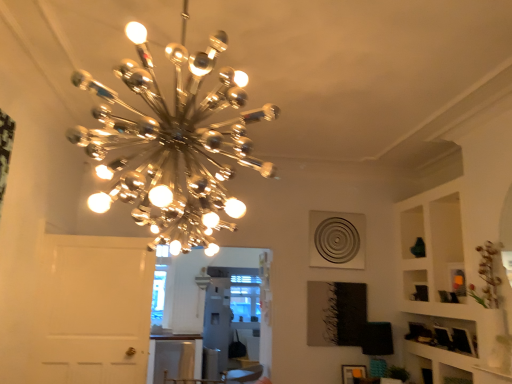
Question: Is matte orange picture frame at lower right a part of white glossy table at lower center?

Choices:
 (A) no
 (B) yes

Answer: (A)

Question: Is white glossy table at lower center smaller than matte orange picture frame at lower right?

Choices:
 (A) yes
 (B) no

Answer: (B)

Question: From the image's perspective, is white glossy table at lower center on top of matte orange picture frame at lower right?

Choices:
 (A) no
 (B) yes

Answer: (A)

Question: Can you confirm if white glossy table at lower center is bigger than matte orange picture frame at lower right?

Choices:
 (A) no
 (B) yes

Answer: (B)

Question: From the image's perspective, is white glossy table at lower center under matte orange picture frame at lower right?

Choices:
 (A) no
 (B) yes

Answer: (B)

Question: From the image's perspective, relative to matte orange picture frame at lower right, is chrome/metallic chandelier at upper center above or below?

Choices:
 (A) above
 (B) below

Answer: (A)

Question: Is chrome/metallic chandelier at upper center inside or outside of matte orange picture frame at lower right?

Choices:
 (A) inside
 (B) outside

Answer: (B)

Question: Considering the relative positions of chrome/metallic chandelier at upper center and matte orange picture frame at lower right in the image provided, is chrome/metallic chandelier at upper center to the left or to the right of matte orange picture frame at lower right?

Choices:
 (A) right
 (B) left

Answer: (B)

Question: From a real-world perspective, relative to matte orange picture frame at lower right, is chrome/metallic chandelier at upper center vertically above or below?

Choices:
 (A) below
 (B) above

Answer: (B)

Question: Considering the positions of point (187, 339) and point (349, 380), is point (187, 339) closer or farther from the camera than point (349, 380)?

Choices:
 (A) closer
 (B) farther

Answer: (B)

Question: Considering the positions of white glossy table at lower center and matte orange picture frame at lower right in the image, is white glossy table at lower center taller or shorter than matte orange picture frame at lower right?

Choices:
 (A) short
 (B) tall

Answer: (B)

Question: From the image's perspective, is white glossy table at lower center above or below matte orange picture frame at lower right?

Choices:
 (A) above
 (B) below

Answer: (B)

Question: Visually, is white glossy table at lower center positioned to the left or to the right of matte orange picture frame at lower right?

Choices:
 (A) left
 (B) right

Answer: (A)

Question: Is point tap(362, 370) positioned closer to the camera than point tap(188, 76)?

Choices:
 (A) closer
 (B) farther

Answer: (B)

Question: Is matte orange picture frame at lower right taller or shorter than chrome/metallic chandelier at upper center?

Choices:
 (A) tall
 (B) short

Answer: (B)